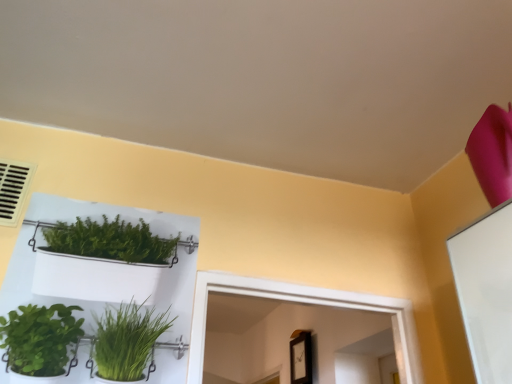
Question: Can you confirm if white plastic shelf at upper left is shorter than beige plastic air conditioning at upper left?

Choices:
 (A) no
 (B) yes

Answer: (A)

Question: Would you consider white plastic shelf at upper left to be distant from beige plastic air conditioning at upper left?

Choices:
 (A) yes
 (B) no

Answer: (B)

Question: Is white plastic shelf at upper left behind beige plastic air conditioning at upper left?

Choices:
 (A) yes
 (B) no

Answer: (B)

Question: Does white plastic shelf at upper left have a greater height compared to beige plastic air conditioning at upper left?

Choices:
 (A) yes
 (B) no

Answer: (A)

Question: Is white plastic shelf at upper left positioned in front of beige plastic air conditioning at upper left?

Choices:
 (A) yes
 (B) no

Answer: (A)

Question: Is white plastic shelf at upper left at the left side of beige plastic air conditioning at upper left?

Choices:
 (A) no
 (B) yes

Answer: (A)

Question: Is beige plastic air conditioning at upper left in front of white plastic shelf at upper left?

Choices:
 (A) yes
 (B) no

Answer: (B)

Question: Is beige plastic air conditioning at upper left at the right side of white plastic shelf at upper left?

Choices:
 (A) yes
 (B) no

Answer: (B)

Question: Is beige plastic air conditioning at upper left not inside white plastic shelf at upper left?

Choices:
 (A) no
 (B) yes

Answer: (B)

Question: Considering the relative sizes of beige plastic air conditioning at upper left and white plastic shelf at upper left in the image provided, is beige plastic air conditioning at upper left wider than white plastic shelf at upper left?

Choices:
 (A) yes
 (B) no

Answer: (A)

Question: Does beige plastic air conditioning at upper left touch white plastic shelf at upper left?

Choices:
 (A) yes
 (B) no

Answer: (B)

Question: Is beige plastic air conditioning at upper left oriented towards white plastic shelf at upper left?

Choices:
 (A) yes
 (B) no

Answer: (B)

Question: Based on their sizes in the image, would you say white plastic shelf at upper left is bigger or smaller than beige plastic air conditioning at upper left?

Choices:
 (A) small
 (B) big

Answer: (B)